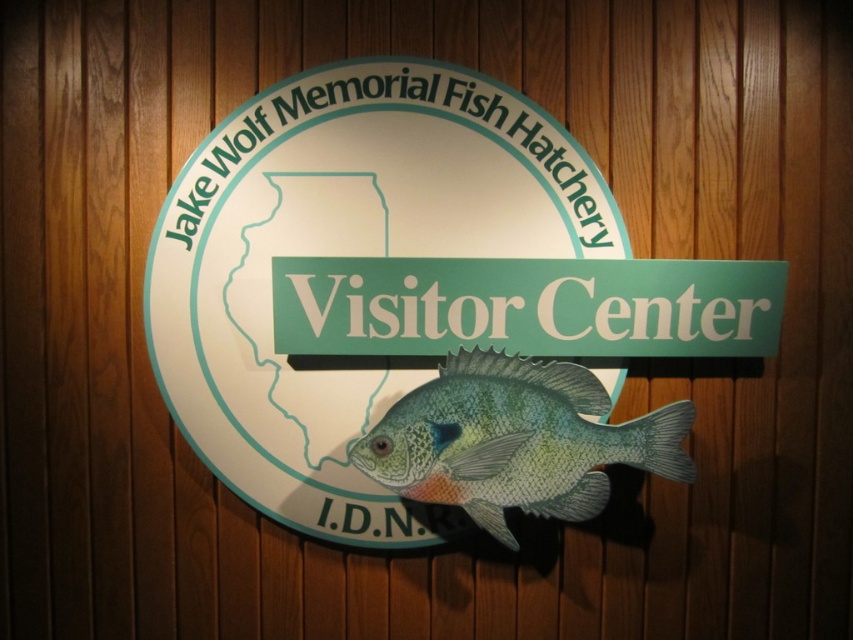
Which is behind, point (614, 220) or point (648, 456)?

The point (614, 220) is more distant.

Can you confirm if matte plastic sign at center is smaller than shiny blue fish at center?

Incorrect, matte plastic sign at center is not smaller in size than shiny blue fish at center.

Between point (154, 244) and point (521, 371), which one is positioned in front?

Positioned in front is point (521, 371).

Identify the location of matte plastic sign at center. (344, 256).